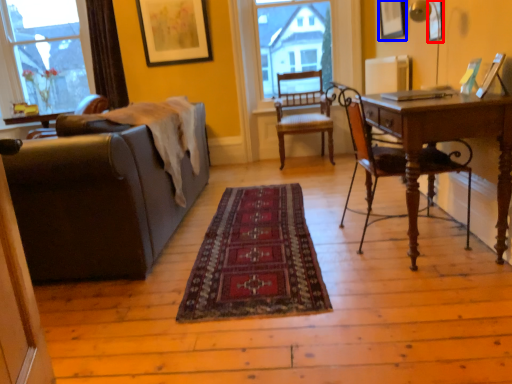
Question: Which object is closer to the camera taking this photo, picture frame (highlighted by a red box) or picture frame (highlighted by a blue box)?

Choices:
 (A) picture frame
 (B) picture frame

Answer: (A)